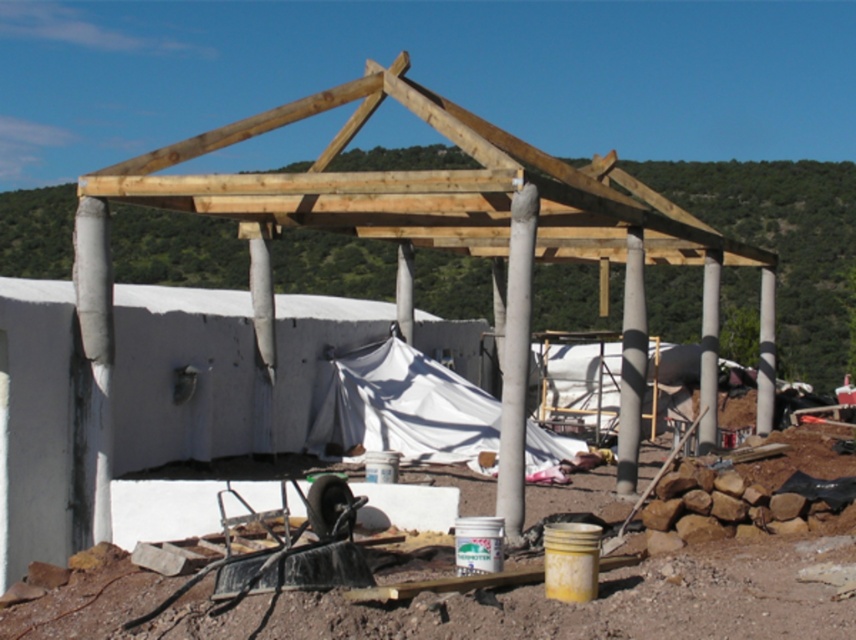
Between point (510, 406) and point (759, 372), which one is positioned behind?

Point (759, 372)

Which is above, smooth concrete pole at center or white concrete column at center?

smooth concrete pole at center

Find the location of a particular element. smooth concrete pole at center is located at coordinates (515, 358).

Image resolution: width=856 pixels, height=640 pixels. What are the coordinates of `smooth concrete pole at center` in the screenshot? It's located at (515, 358).

Is point (623, 272) more distant than point (774, 358)?

Yes, point (623, 272) is farther from viewer.

Does gray concrete pole at center have a greater width compared to white concrete column at center?

No.

You are a GUI agent. You are given a task and a screenshot of the screen. Output one action in this format:
    pyautogui.click(x=<x>, y=<y>)
    Task: Click on the gray concrete pole at center
    Image resolution: width=856 pixels, height=640 pixels.
    Given the screenshot: What is the action you would take?
    pyautogui.click(x=631, y=364)

Does white fabric canopy at center come in front of white concrete column at center?

Yes, white fabric canopy at center is in front of white concrete column at center.

Can you confirm if white fabric canopy at center is positioned above white concrete column at center?

No.

Measure the distance between white fabric canopy at center and camera.

white fabric canopy at center is 49.13 feet away from camera.

The height and width of the screenshot is (640, 856). I want to click on white fabric canopy at center, so click(405, 408).